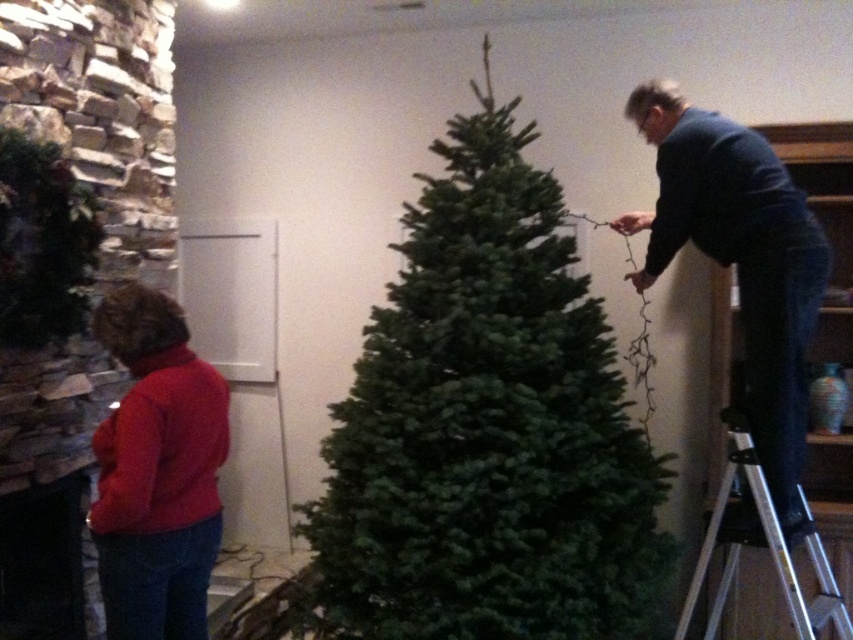
You are standing in the room and want to hand a decoration to the person in the dark blue suit at right. Which direction should you move to reach them from the red matte sweater at lower left?

You should move to the right from the red matte sweater at lower left to reach the dark blue suit at right since the dark blue suit at right is to the right of red matte sweater at lower left.

You are a photographer trying to capture a clear photo of the dark blue suit at right and the silver metallic ladder at right. However, the ladder is blocking part of the suit. Where should you position yourself to ensure both objects are fully visible?

Move to the left side of the silver metallic ladder at right so that the ladder is no longer blocking the dark blue suit at right.